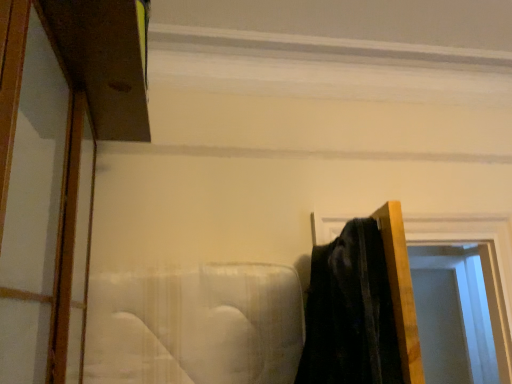
Image resolution: width=512 pixels, height=384 pixels. Describe the element at coordinates (483, 263) in the screenshot. I see `wooden door frame at right` at that location.

Where is `wooden door frame at right`? Image resolution: width=512 pixels, height=384 pixels. wooden door frame at right is located at coordinates (483, 263).

The image size is (512, 384). What do you see at coordinates (458, 315) in the screenshot?
I see `transparent glass door at right` at bounding box center [458, 315].

What is the approximate height of transparent glass door at right?

34.28 inches.

Locate an element on the screen. transparent glass door at right is located at coordinates (458, 315).

Measure the distance between point (435,329) and camera.

Point (435,329) and camera are 3.05 meters apart from each other.

Image resolution: width=512 pixels, height=384 pixels. In order to click on wooden door frame at right in this screenshot , I will do `click(483, 263)`.

In the image, is wooden door frame at right on the left side or the right side of transparent glass door at right?

wooden door frame at right is to the left of transparent glass door at right.

Is the position of wooden door frame at right more distant than that of transparent glass door at right?

No, it is in front of transparent glass door at right.

Between point (507, 364) and point (440, 268), which one is positioned in front?

The point (507, 364) is closer.

From the picture: From the image's perspective, does wooden door frame at right appear lower than transparent glass door at right?

No, from the image's perspective, wooden door frame at right is not beneath transparent glass door at right.

From a real-world perspective, is wooden door frame at right below transparent glass door at right?

No, from a real-world perspective, wooden door frame at right is not below transparent glass door at right.

Which object is wider, wooden door frame at right or transparent glass door at right?

wooden door frame at right.

Between wooden door frame at right and transparent glass door at right, which one has less height?

wooden door frame at right.

Can you confirm if wooden door frame at right is smaller than transparent glass door at right?

No.

Would you say wooden door frame at right is outside transparent glass door at right?

Absolutely, wooden door frame at right is external to transparent glass door at right.

Consider the image. Is wooden door frame at right not close to transparent glass door at right?

Yes, wooden door frame at right and transparent glass door at right are located far from each other.

Is wooden door frame at right looking in the opposite direction of transparent glass door at right?

Absolutely, wooden door frame at right is directed away from transparent glass door at right.

How many degrees apart are the facing directions of wooden door frame at right and transparent glass door at right?

8.41 degrees separate the facing orientations of wooden door frame at right and transparent glass door at right.

Find the location of a particular element. window that appears below the wooden door frame at right (from the image's perspective) is located at coordinates (458, 315).

Does transparent glass door at right appear on the left side of wooden door frame at right?

No.

Who is more distant, transparent glass door at right or wooden door frame at right?

transparent glass door at right is more distant.

Is point (454, 320) more distant than point (333, 222)?

That is True.

From the image's perspective, which is above, transparent glass door at right or wooden door frame at right?

wooden door frame at right is shown above in the image.

From a real-world perspective, is transparent glass door at right physically above wooden door frame at right?

No, from a real-world perspective, transparent glass door at right is not over wooden door frame at right

Considering the relative sizes of transparent glass door at right and wooden door frame at right in the image provided, is transparent glass door at right thinner than wooden door frame at right?

Correct, the width of transparent glass door at right is less than that of wooden door frame at right.

From the picture: Can you confirm if transparent glass door at right is shorter than wooden door frame at right?

Incorrect, the height of transparent glass door at right does not fall short of that of wooden door frame at right.

Who is smaller, transparent glass door at right or wooden door frame at right?

transparent glass door at right is smaller.

Is wooden door frame at right completely or partially inside transparent glass door at right?

No.

Is the surface of transparent glass door at right in direct contact with wooden door frame at right?

No, transparent glass door at right is not touching wooden door frame at right.

Is wooden door frame at right at the back of transparent glass door at right?

transparent glass door at right is not turned away from wooden door frame at right.

How many degrees apart are the facing directions of transparent glass door at right and wooden door frame at right?

The angle between the facing direction of transparent glass door at right and the facing direction of wooden door frame at right is 8.41 degrees.

The height and width of the screenshot is (384, 512). Identify the location of window frame that appears above the transparent glass door at right (from the image's perspective). (483, 263).

Find the location of `window lying on the right of wooden door frame at right`. window lying on the right of wooden door frame at right is located at coordinates (458, 315).

Where is `window frame in front of the transparent glass door at right`? window frame in front of the transparent glass door at right is located at coordinates coord(483,263).